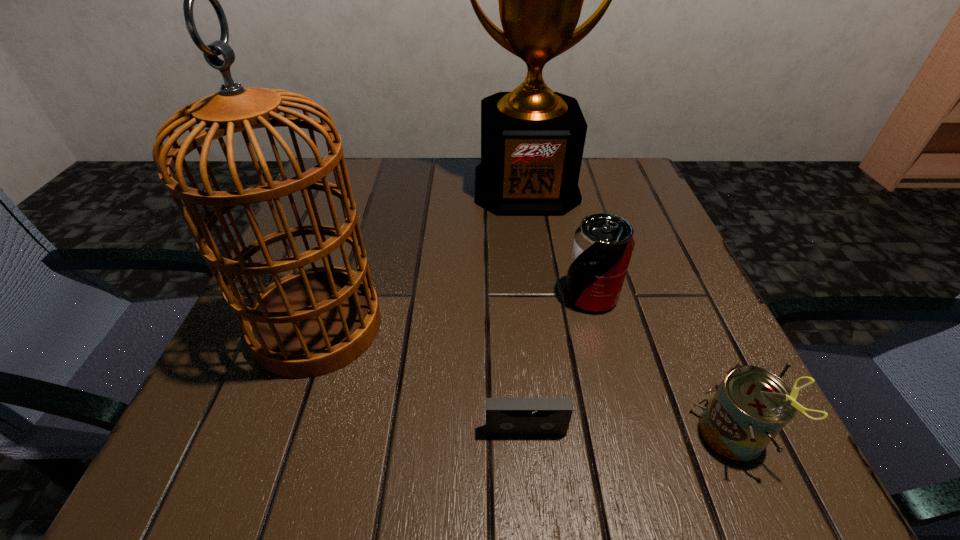
Image resolution: width=960 pixels, height=540 pixels. I want to click on vacant point located between the shortest object and the farthest object, so click(x=526, y=308).

Find the location of `free spot between the can and the videotape`. free spot between the can and the videotape is located at coordinates (630, 433).

Locate an element on the screen. This screenshot has height=540, width=960. free point between the can and the birdcage is located at coordinates (526, 381).

At what (x,y) coordinates should I click in order to perform the action: click on empty location between the leftmost object and the can. Please return your answer as a coordinate pair (x, y). Image resolution: width=960 pixels, height=540 pixels. Looking at the image, I should click on (526, 381).

Locate an element on the screen. This screenshot has width=960, height=540. vacant area that lies between the can and the birdcage is located at coordinates (526, 381).

At what (x,y) coordinates should I click in order to perform the action: click on free space between the soda can and the shortest object. Please return your answer as a coordinate pair (x, y). Image resolution: width=960 pixels, height=540 pixels. Looking at the image, I should click on (558, 363).

This screenshot has height=540, width=960. What are the coordinates of `empty space between the soda can and the leftmost object` in the screenshot? It's located at (454, 310).

Identify which object is located as the second nearest to the shortest object. Please provide its 2D coordinates. Your answer should be formatted as a tuple, i.e. [(x, y)], where the tuple contains the x and y coordinates of a point satisfying the conditions above.

[(312, 322)]

I want to click on object that stands as the third closest to the birdcage, so click(x=602, y=247).

In order to click on free region that satisfies the following two spatial constraints: 1. on the front-facing side of the videotape; 2. on the left side of the can in this screenshot , I will do `click(526, 435)`.